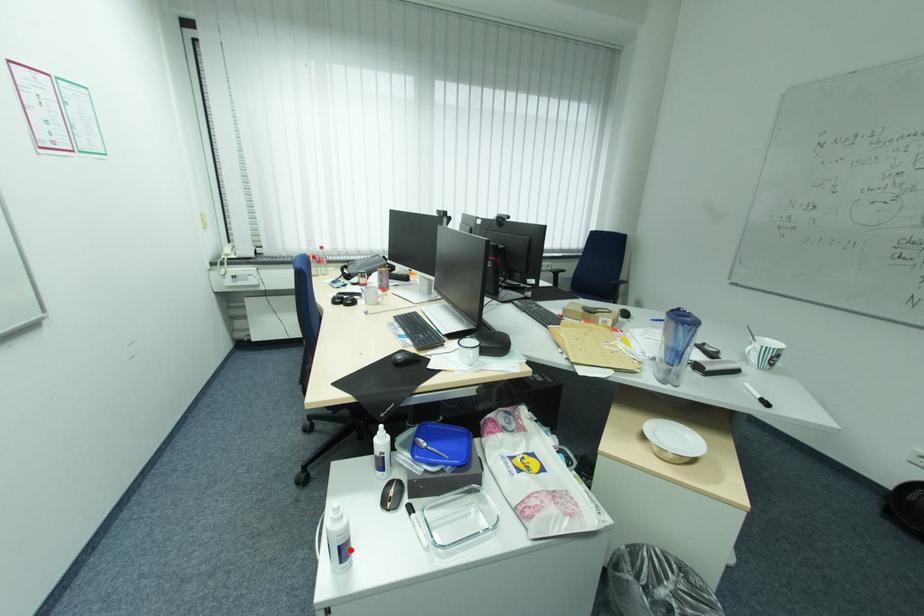
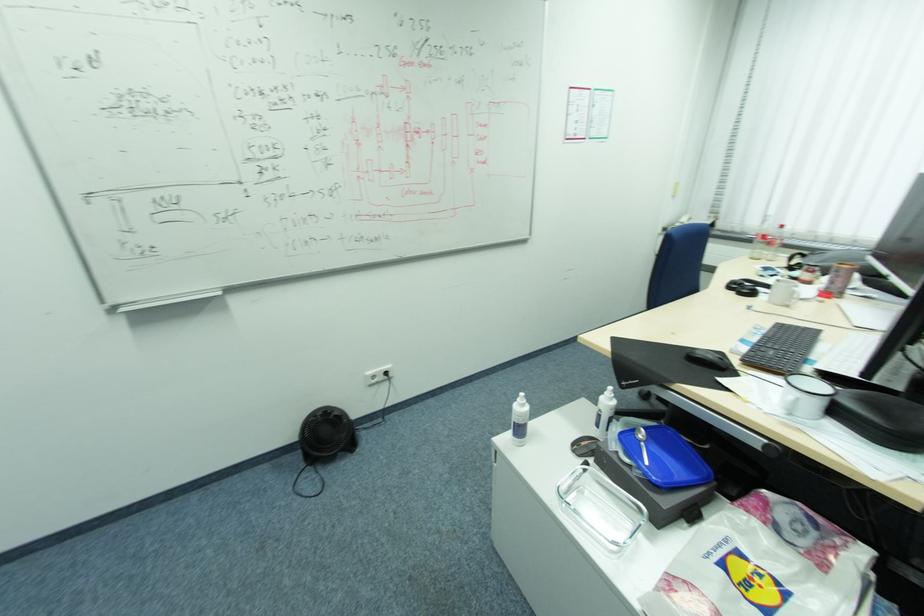
The point at the highlighted location is marked in the first image. Where is the corresponding point in the second image?

(526, 430)